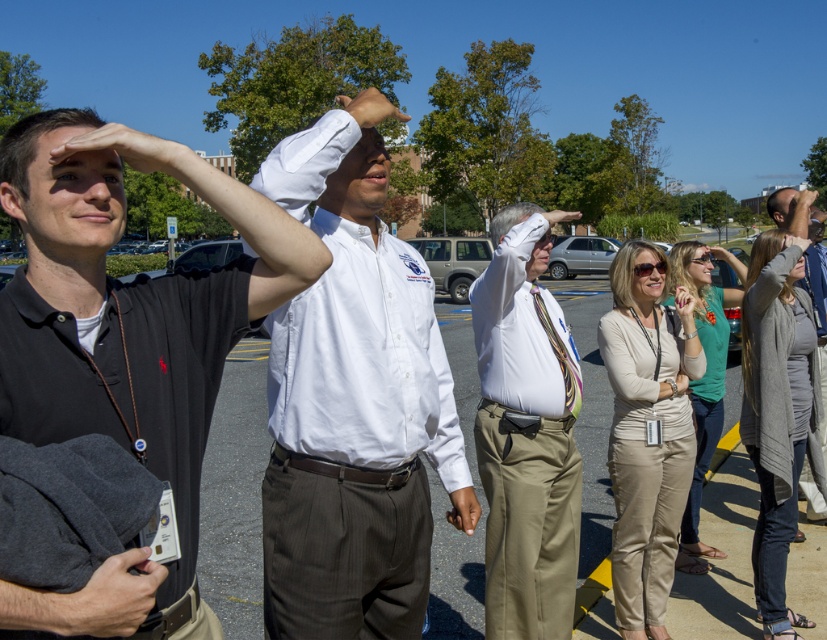
You are standing in the parking lot and want to find the light beige pants at center. According to the coordinates provided, where should you look relative to the other objects in the scene?

The light beige pants at center is located at point coordinates (526,433), which places it centrally in the scene.

You are a photographer trying to capture a group photo of the matte black shirt at left and the white cotton shirt at center. Since you want both shirts to appear the same size in the photo, which direction should you move your camera? Explain your reasoning based on their current positions and sizes.

Since the matte black shirt at left has a lesser width compared to the white cotton shirt at center, you should move the camera to the left. This will make the closer matte black shirt at left appear smaller and the farther white cotton shirt at center appear larger, balancing their sizes in the photo.